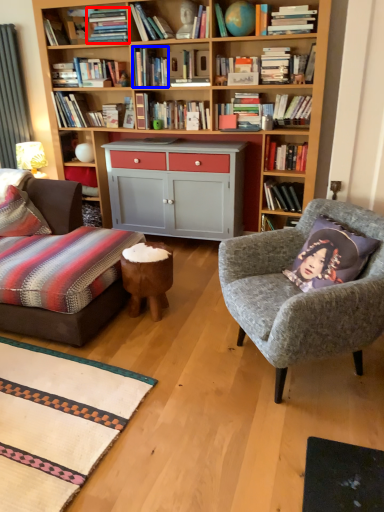
Question: Which point is further to the camera, book (highlighted by a red box) or book (highlighted by a blue box)?

Choices:
 (A) book
 (B) book

Answer: (B)